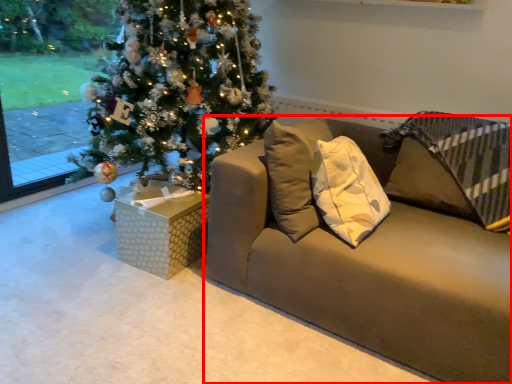
Question: Observing the image, what is the correct spatial positioning of studio couch (annotated by the red box) in reference to furniture?

Choices:
 (A) left
 (B) right

Answer: (B)